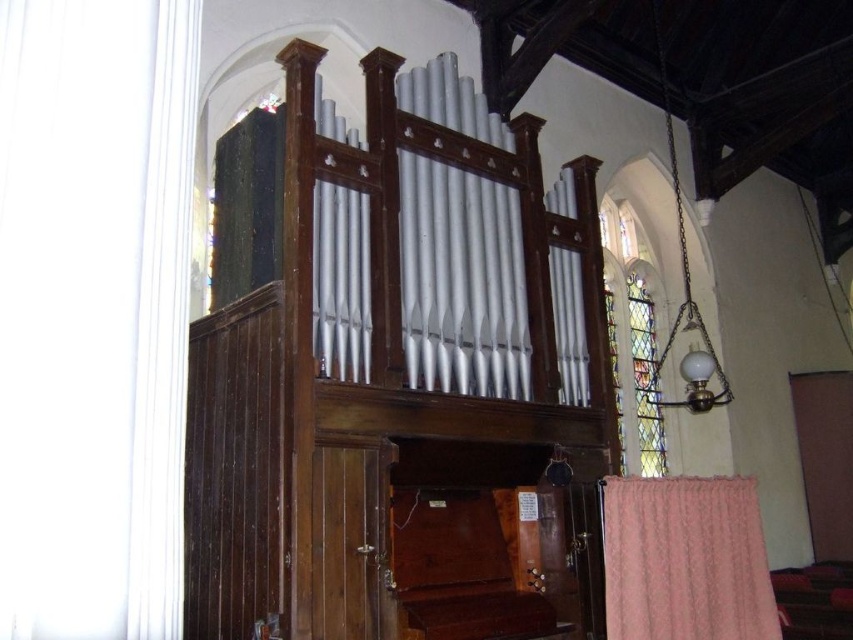
Question: Which point is farther to the camera?

Choices:
 (A) (502, 145)
 (B) (624, 204)
 (C) (637, 531)
 (D) (270, 218)

Answer: (B)

Question: Does metallic silver pipes at center appear over stained glass at upper right?

Choices:
 (A) no
 (B) yes

Answer: (A)

Question: Which of these objects is positioned farthest from the black velvet curtain at upper left?

Choices:
 (A) metallic silver pipes at center
 (B) stained glass at upper right
 (C) pink knitted curtain at lower right

Answer: (B)

Question: Can you confirm if pink knitted curtain at lower right is positioned above stained glass at upper right?

Choices:
 (A) no
 (B) yes

Answer: (A)

Question: Is black velvet curtain at upper left wider than stained glass at upper right?

Choices:
 (A) no
 (B) yes

Answer: (A)

Question: Which of these objects is positioned closest to the metallic silver pipes at center?

Choices:
 (A) stained glass at upper right
 (B) pink knitted curtain at lower right

Answer: (B)